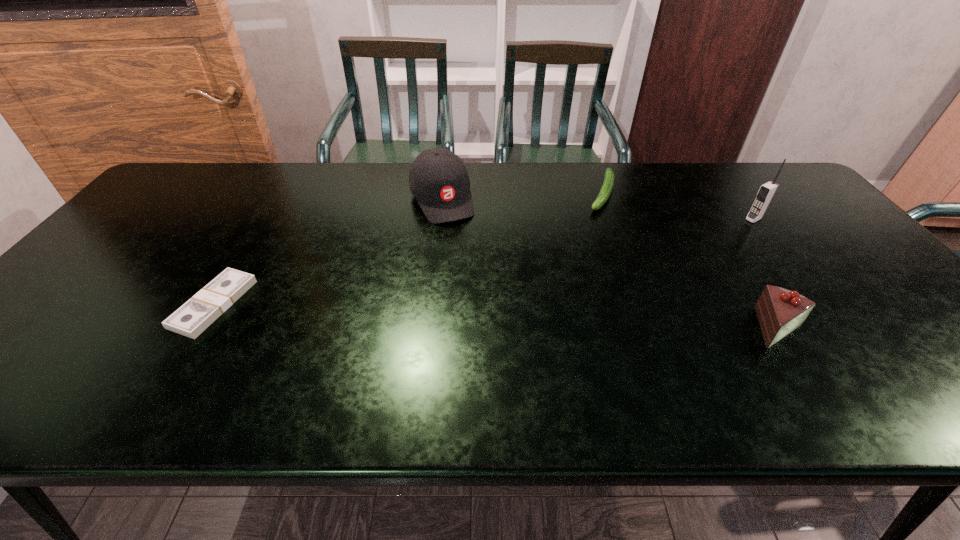
Where is `vacant space located 0.200m on the left of the leftmost object`? The width and height of the screenshot is (960, 540). vacant space located 0.200m on the left of the leftmost object is located at coordinates (99, 304).

Locate an element on the screen. vacant space located on the back of the third shortest object is located at coordinates (726, 248).

The height and width of the screenshot is (540, 960). In order to click on free space located 0.350m on the front-facing side of the zucchini in this screenshot , I will do `click(574, 288)`.

This screenshot has width=960, height=540. Identify the location of vacant area situated on the front-facing side of the zucchini. (588, 249).

You are a GUI agent. You are given a task and a screenshot of the screen. Output one action in this format:
    pyautogui.click(x=<x>, y=<y>)
    Task: Click on the blank space located 0.310m on the front-facing side of the zucchini
    This screenshot has height=540, width=960.
    Given the screenshot: What is the action you would take?
    pyautogui.click(x=578, y=278)

What are the coordinates of `vacant area situated with a logo on the front of the baseball cap` in the screenshot? It's located at (462, 247).

This screenshot has width=960, height=540. Find the location of `vacant space located 0.150m with a logo on the front of the baseball cap`. vacant space located 0.150m with a logo on the front of the baseball cap is located at coordinates (467, 255).

Locate an element on the screen. The height and width of the screenshot is (540, 960). vacant space located 0.080m with a logo on the front of the baseball cap is located at coordinates click(x=459, y=240).

I want to click on free region located on the front-facing side of the rightmost object, so click(732, 231).

You are a GUI agent. You are given a task and a screenshot of the screen. Output one action in this format:
    pyautogui.click(x=<x>, y=<y>)
    Task: Click on the free point located 0.290m on the front-facing side of the rightmost object
    The width and height of the screenshot is (960, 540).
    Given the screenshot: What is the action you would take?
    pyautogui.click(x=684, y=256)